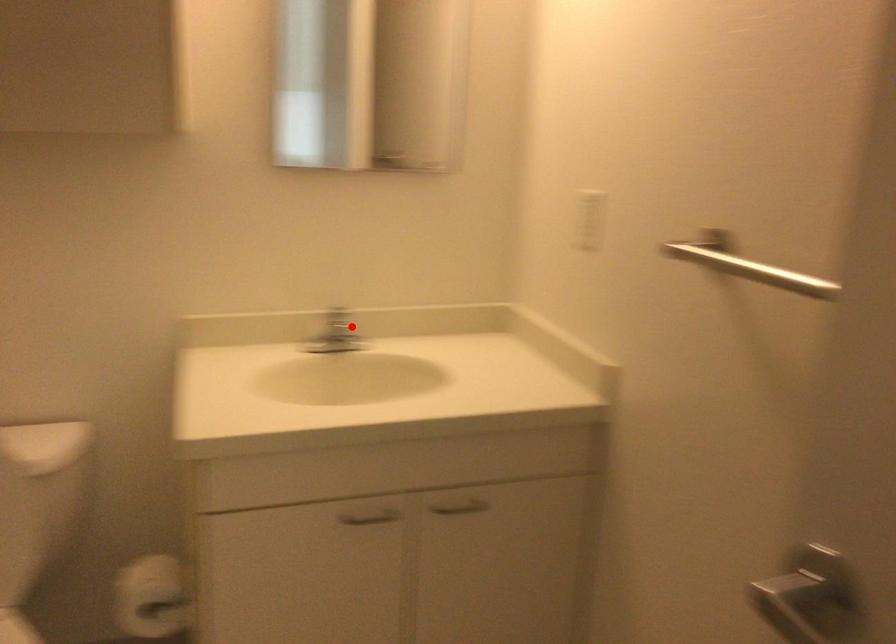
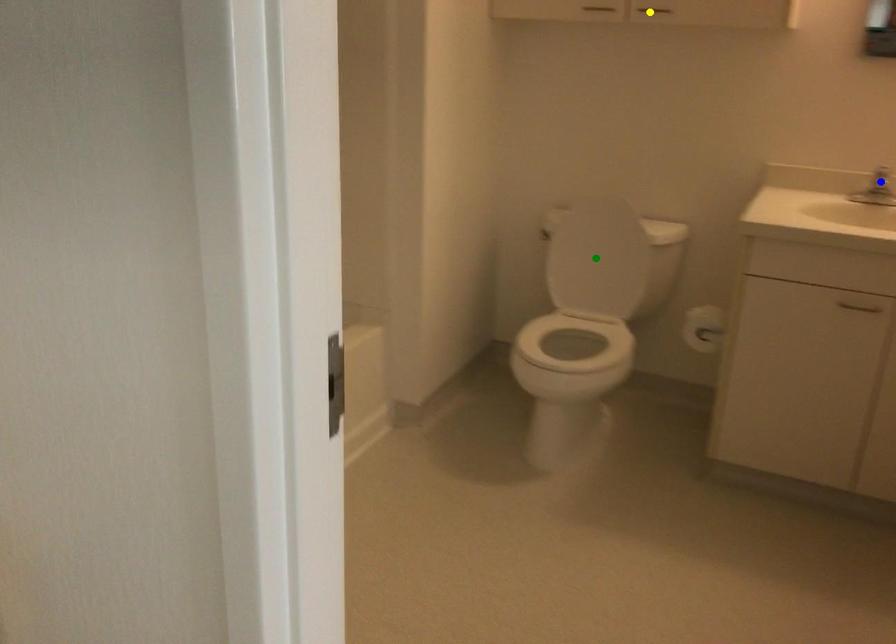
Question: I am providing you with two images of the same scene from different viewpoints. A red point is marked on the first image. You are given multiple points on the second image. In image 2, which mark is for the same physical point as the one in image 1?

Choices:
 (A) blue point
 (B) green point
 (C) yellow point

Answer: (A)